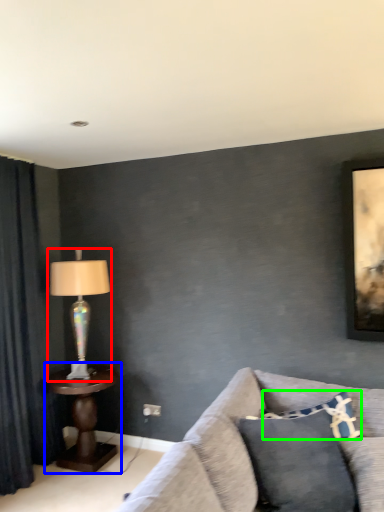
Question: Which object is the farthest from lamp (highlighted by a red box)? Choose among these: table (highlighted by a blue box) or pillow (highlighted by a green box).

Choices:
 (A) table
 (B) pillow

Answer: (B)